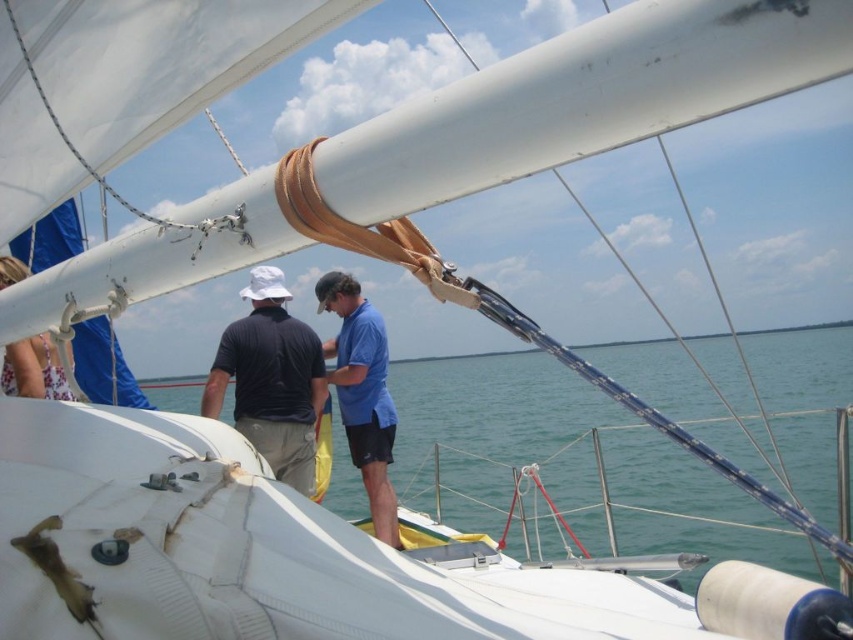
Looking at this image, you are on a sailboat and need to secure a rope to the deck. You see the blue water at center and the matte black shirt at center. Which object is closer to you, the observer?

The blue water at center is closer to the viewer than the matte black shirt at center, so the blue water at center is closer to you.

You are standing on the deck of the sailboat and want to locate the blue water at center. Using the coordinate system where the bottom left corner is the origin, can you confirm if the blue water at center is located at point (572, 464)?

Yes, the blue water at center is located at point (572, 464) according to the coordinates provided.